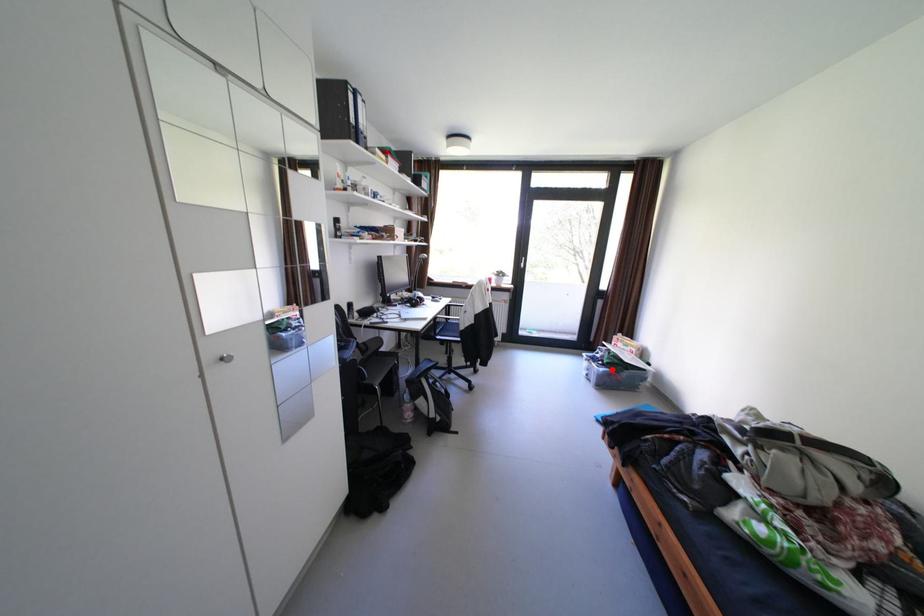
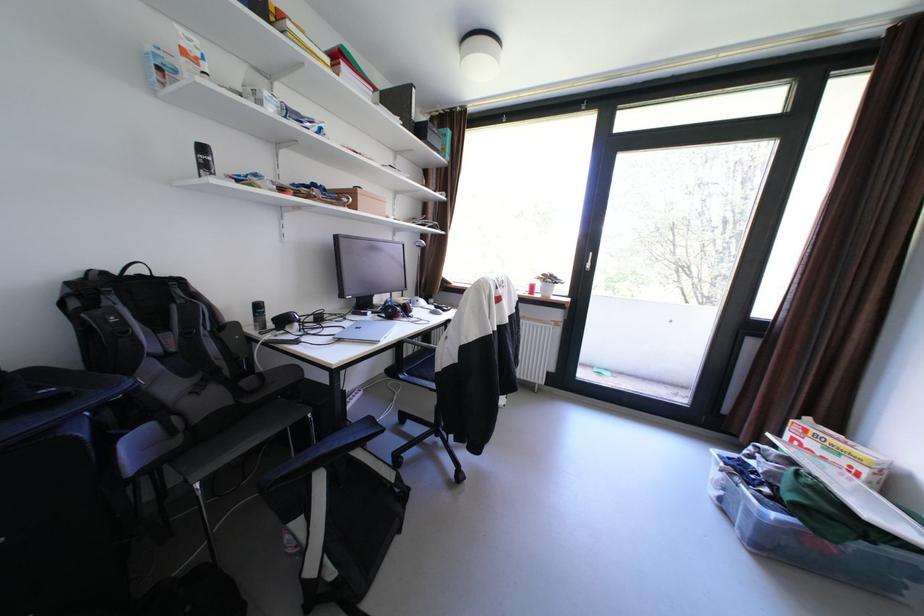
Question: I am providing you with two images of the same scene from different viewpoints. In image1, a red point is highlighted. Considering the same 3D point in image2, which of the following is correct?

Choices:
 (A) It is closer
 (B) It is farther

Answer: (A)